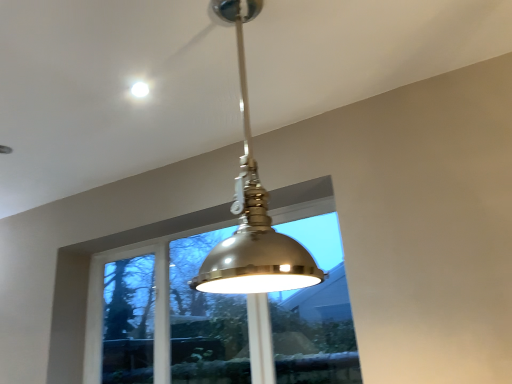
At what (x,y) coordinates should I click in order to perform the action: click on metallic dome at upper center. Please return your answer as a coordinate pair (x, y). Image resolution: width=512 pixels, height=384 pixels. Looking at the image, I should click on (140, 89).

Where is `clear glass window at center`? clear glass window at center is located at coordinates (172, 316).

This screenshot has height=384, width=512. I want to click on metallic dome at upper center, so click(x=140, y=89).

Is clear glass window at center a part of metallic dome at center?

No, clear glass window at center is not a part of metallic dome at center.

Is metallic dome at center facing towards clear glass window at center?

No, metallic dome at center is not facing towards clear glass window at center.

Measure the distance from metallic dome at center to clear glass window at center.

They are 4.54 feet apart.

Considering the relative sizes of metallic dome at center and clear glass window at center in the image provided, is metallic dome at center thinner than clear glass window at center?

No, metallic dome at center is not thinner than clear glass window at center.

Considering the relative sizes of clear glass window at center and metallic dome at upper center in the image provided, is clear glass window at center shorter than metallic dome at upper center?

No.

Is point (340, 312) positioned behind point (139, 90)?

Yes.

Choose the correct answer: Is clear glass window at center inside metallic dome at upper center or outside it?

clear glass window at center is located beyond the bounds of metallic dome at upper center.

Considering the relative sizes of clear glass window at center and metallic dome at center in the image provided, is clear glass window at center thinner than metallic dome at center?

Indeed, clear glass window at center has a lesser width compared to metallic dome at center.

Relative to metallic dome at center, is clear glass window at center in front or behind?

Visually, clear glass window at center is located behind metallic dome at center.

Considering the relative positions of clear glass window at center and metallic dome at center in the image provided, is clear glass window at center to the left or to the right of metallic dome at center?

clear glass window at center is to the left of metallic dome at center.

Which is farther, (x=252, y=206) or (x=134, y=96)?

The point (x=134, y=96) is farther from the camera.

From the image's perspective, does metallic dome at center appear lower than metallic dome at upper center?

Correct, metallic dome at center appears lower than metallic dome at upper center in the image.

In the scene shown: Is metallic dome at center behind metallic dome at upper center?

No.

Which of these two, metallic dome at center or metallic dome at upper center, is bigger?

metallic dome at center.

Which of these two, metallic dome at upper center or metallic dome at center, is wider?

Wider between the two is metallic dome at center.

From the image's perspective, which one is positioned lower, metallic dome at upper center or metallic dome at center?

metallic dome at center appears lower in the image.

Are metallic dome at upper center and metallic dome at center beside each other?

No, metallic dome at upper center is not in contact with metallic dome at center.

Is metallic dome at upper center turned away from metallic dome at center?

No, metallic dome at upper center is not facing the opposite direction of metallic dome at center.

Locate an element on the screen. The height and width of the screenshot is (384, 512). window on the right of the metallic dome at upper center is located at coordinates (172, 316).

Between metallic dome at upper center and clear glass window at center, which one has more height?

With more height is clear glass window at center.

Is metallic dome at upper center further to camera compared to clear glass window at center?

That is False.

This screenshot has height=384, width=512. Find the location of `window that is behind the metallic dome at center`. window that is behind the metallic dome at center is located at coordinates (172, 316).

Image resolution: width=512 pixels, height=384 pixels. What are the coordinates of `window on the right side of metallic dome at upper center` in the screenshot? It's located at (172, 316).

Looking at this image, which object lies further to the anchor point metallic dome at upper center, metallic dome at center or clear glass window at center?

Among the two, clear glass window at center is located further to metallic dome at upper center.

Which object lies further to the anchor point clear glass window at center, metallic dome at upper center or metallic dome at center?

metallic dome at upper center is positioned further to the anchor clear glass window at center.

Estimate the real-world distances between objects in this image. Which object is further from metallic dome at center, clear glass window at center or metallic dome at upper center?

clear glass window at center is positioned further to the anchor metallic dome at center.

In the scene shown: Estimate the real-world distances between objects in this image. Which object is further from metallic dome at upper center, clear glass window at center or metallic dome at center?

clear glass window at center lies further to metallic dome at upper center than the other object.

Which object lies further to the anchor point clear glass window at center, metallic dome at center or metallic dome at upper center?

metallic dome at upper center is further to clear glass window at center.

Looking at the image, which one is located closer to metallic dome at center, metallic dome at upper center or clear glass window at center?

metallic dome at upper center is positioned closer to the anchor metallic dome at center.

Identify the location of droplight between metallic dome at center and clear glass window at center in the front-back direction. The width and height of the screenshot is (512, 384). (140, 89).